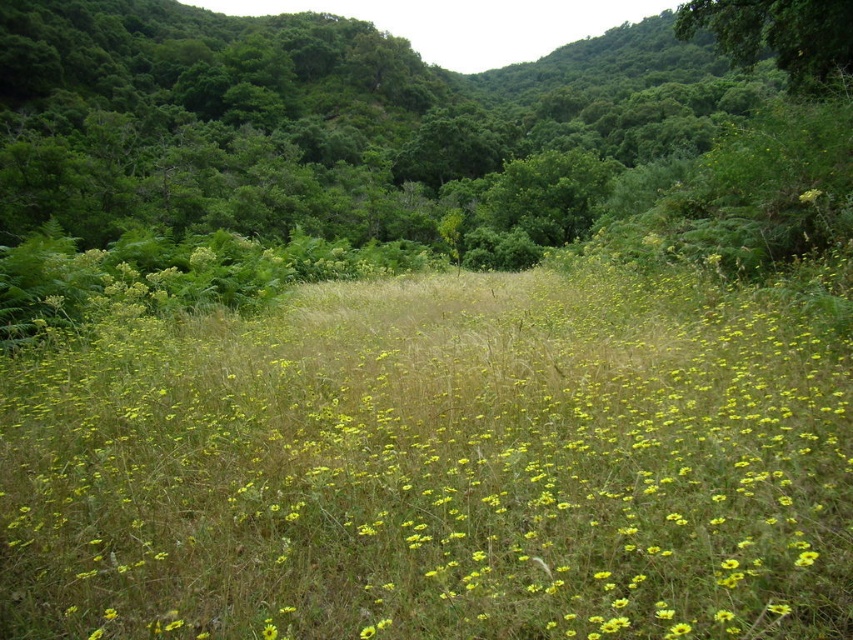
You are standing in the middle of the yellow wildflowers and notice the yellow grass at center and the green leafy tree at upper right. Which object is positioned to the left of the other?

The yellow grass at center is to the left of the green leafy tree at upper right.

You are a botanist studying the yellow grass at center and the yellow matte flower at center in the image. Which of these two plants has a larger size according to the description?

The yellow grass at center has a larger size compared to the yellow matte flower at center.